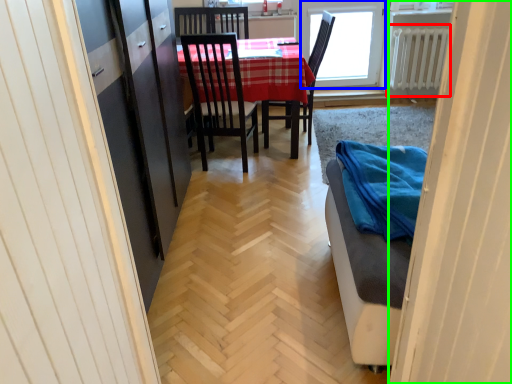
Question: Which object is the farthest from radiator (highlighted by a red box)? Choose among these: window (highlighted by a blue box) or door (highlighted by a green box).

Choices:
 (A) window
 (B) door

Answer: (B)